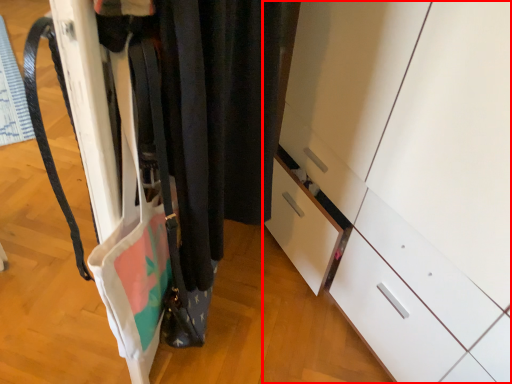
Question: Considering the relative positions of cabinetry (annotated by the red box) and closet in the image provided, where is cabinetry (annotated by the red box) located with respect to the staircase?

Choices:
 (A) left
 (B) right

Answer: (B)